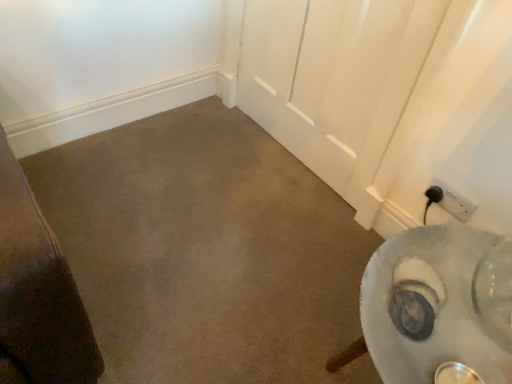
The width and height of the screenshot is (512, 384). Describe the element at coordinates (206, 251) in the screenshot. I see `brown matte concrete at center` at that location.

The width and height of the screenshot is (512, 384). I want to click on brown matte concrete at center, so click(206, 251).

The width and height of the screenshot is (512, 384). What do you see at coordinates (448, 201) in the screenshot?
I see `black plastic power plug at lower right` at bounding box center [448, 201].

What is the approximate height of black plastic power plug at lower right?

The height of black plastic power plug at lower right is 3.77 inches.

Image resolution: width=512 pixels, height=384 pixels. What are the coordinates of `black plastic power plug at lower right` in the screenshot? It's located at (448, 201).

The height and width of the screenshot is (384, 512). Identify the location of brown matte concrete at center. (206, 251).

Between brown matte concrete at center and black plastic power plug at lower right, which one appears on the right side from the viewer's perspective?

black plastic power plug at lower right is more to the right.

Which is in front, brown matte concrete at center or black plastic power plug at lower right?

brown matte concrete at center is closer to the camera.

Which point is more distant from viewer, (252, 132) or (434, 179)?

The point (252, 132) is farther from the camera.

From the image's perspective, is brown matte concrete at center above or below black plastic power plug at lower right?

brown matte concrete at center is below black plastic power plug at lower right.

From a real-world perspective, does brown matte concrete at center sit lower than black plastic power plug at lower right?

Indeed, from a real-world perspective, brown matte concrete at center is positioned beneath black plastic power plug at lower right.

Does brown matte concrete at center have a lesser width compared to black plastic power plug at lower right?

In fact, brown matte concrete at center might be wider than black plastic power plug at lower right.

Considering the sizes of objects brown matte concrete at center and black plastic power plug at lower right in the image provided, who is taller, brown matte concrete at center or black plastic power plug at lower right?

Standing taller between the two is black plastic power plug at lower right.

Between brown matte concrete at center and black plastic power plug at lower right, which one has smaller size?

Smaller between the two is black plastic power plug at lower right.

Is brown matte concrete at center not within black plastic power plug at lower right?

That's correct, brown matte concrete at center is outside of black plastic power plug at lower right.

Are brown matte concrete at center and black plastic power plug at lower right far apart?

They are positioned close to each other.

Does brown matte concrete at center turn towards black plastic power plug at lower right?

No, brown matte concrete at center is not turned towards black plastic power plug at lower right.

How many degrees apart are the facing directions of brown matte concrete at center and black plastic power plug at lower right?

The angular difference between brown matte concrete at center and black plastic power plug at lower right is 89.7 degrees.

At what (x,y) coordinates should I click in order to perform the action: click on concrete that appears in front of the black plastic power plug at lower right. Please return your answer as a coordinate pair (x, y). This screenshot has height=384, width=512. Looking at the image, I should click on (206, 251).

Is black plastic power plug at lower right to the right of brown matte concrete at center from the viewer's perspective?

Correct, you'll find black plastic power plug at lower right to the right of brown matte concrete at center.

In the scene shown: Considering the positions of objects black plastic power plug at lower right and brown matte concrete at center in the image provided, who is in front, black plastic power plug at lower right or brown matte concrete at center?

Positioned in front is brown matte concrete at center.

Does point (449, 211) come behind point (81, 227)?

That is False.

Consider the image. From the image's perspective, is black plastic power plug at lower right located beneath brown matte concrete at center?

Actually, black plastic power plug at lower right appears above brown matte concrete at center in the image.

From a real-world perspective, does black plastic power plug at lower right sit lower than brown matte concrete at center?

No.

Is black plastic power plug at lower right thinner than brown matte concrete at center?

Yes.

Between black plastic power plug at lower right and brown matte concrete at center, which one has less height?

brown matte concrete at center.

Considering the sizes of objects black plastic power plug at lower right and brown matte concrete at center in the image provided, who is smaller, black plastic power plug at lower right or brown matte concrete at center?

With smaller size is black plastic power plug at lower right.

Could brown matte concrete at center be considered to be inside black plastic power plug at lower right?

No.

Is black plastic power plug at lower right positioned far away from brown matte concrete at center?

They are positioned close to each other.

Is black plastic power plug at lower right oriented away from brown matte concrete at center?

black plastic power plug at lower right is not turned away from brown matte concrete at center.

How many degrees apart are the facing directions of black plastic power plug at lower right and brown matte concrete at center?

They differ by 89.7 degrees in their facing directions.

Where is `concrete in front of the black plastic power plug at lower right`? This screenshot has width=512, height=384. concrete in front of the black plastic power plug at lower right is located at coordinates (206, 251).

Locate an element on the screen. The width and height of the screenshot is (512, 384). concrete on the left of black plastic power plug at lower right is located at coordinates (206, 251).

The image size is (512, 384). In order to click on concrete located below the black plastic power plug at lower right (from the image's perspective) in this screenshot , I will do tap(206, 251).